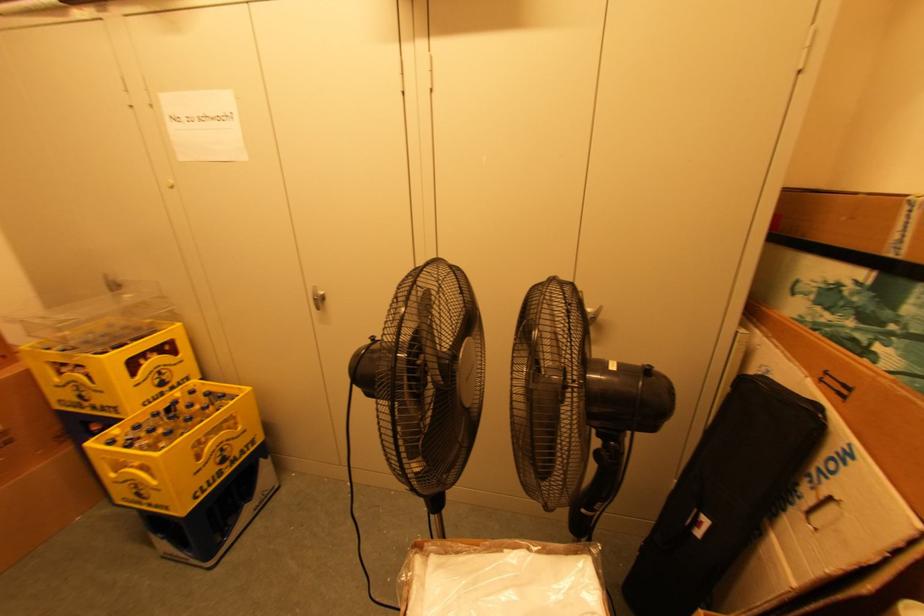
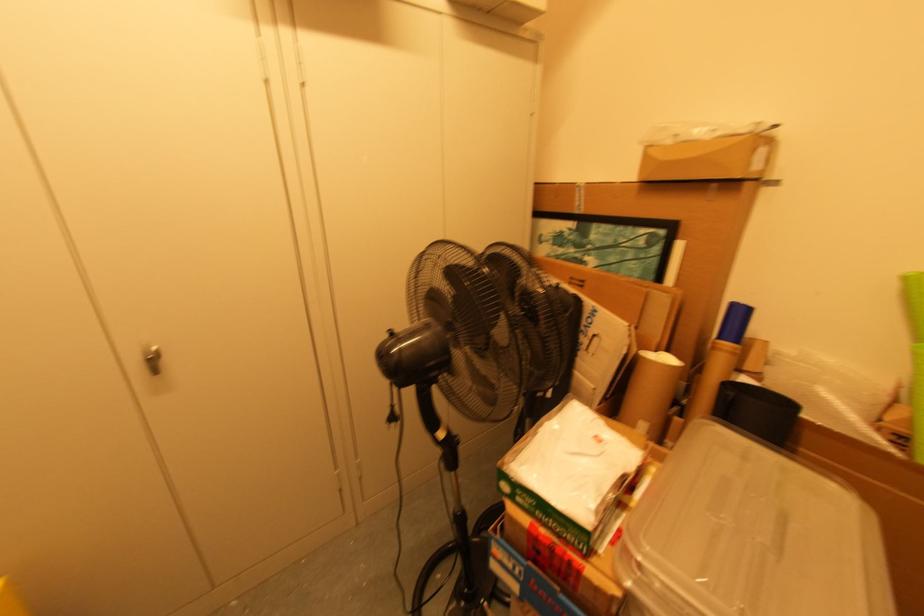
The point at (322, 301) is marked in the first image. Where is the corresponding point in the second image?

(152, 361)